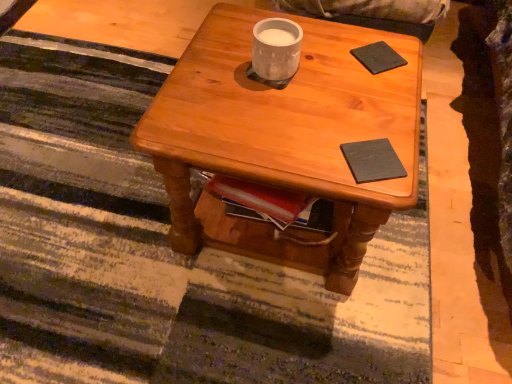
Find the location of a particular element. The height and width of the screenshot is (384, 512). free space to the left of dark matte book at center, the 1th pad positioned from the bottom is located at coordinates (298, 145).